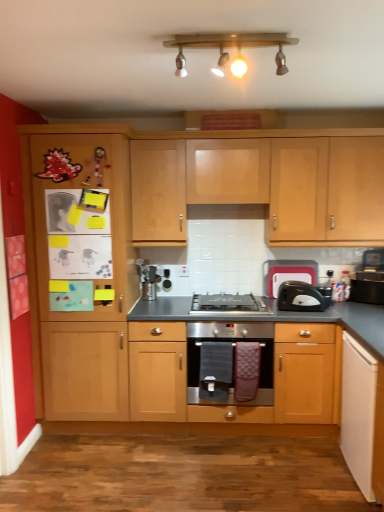
Question: Considering the relative positions of light wood cabinet at upper center, marked as the third cabinetry in a bottom-to-top arrangement, and satin black gas stove at center in the image provided, is light wood cabinet at upper center, marked as the third cabinetry in a bottom-to-top arrangement, to the right of satin black gas stove at center from the viewer's perspective?

Choices:
 (A) yes
 (B) no

Answer: (A)

Question: Considering the relative sizes of light wood cabinet at upper center, acting as the first cabinetry starting from the top, and satin black gas stove at center in the image provided, is light wood cabinet at upper center, acting as the first cabinetry starting from the top, shorter than satin black gas stove at center?

Choices:
 (A) yes
 (B) no

Answer: (B)

Question: From a real-world perspective, is light wood cabinet at upper center, acting as the first cabinetry starting from the top, on satin black gas stove at center?

Choices:
 (A) no
 (B) yes

Answer: (B)

Question: Is light wood cabinet at upper center, marked as the third cabinetry in a bottom-to-top arrangement, aimed at satin black gas stove at center?

Choices:
 (A) no
 (B) yes

Answer: (A)

Question: Does light wood cabinet at upper center, acting as the first cabinetry starting from the top, have a greater width compared to satin black gas stove at center?

Choices:
 (A) no
 (B) yes

Answer: (A)

Question: Is light wood cabinet at upper center, marked as the third cabinetry in a bottom-to-top arrangement, bigger than wooden cabinet at left?

Choices:
 (A) yes
 (B) no

Answer: (B)

Question: Is the position of light wood cabinet at upper center, marked as the third cabinetry in a bottom-to-top arrangement, more distant than that of wooden cabinet at left?

Choices:
 (A) no
 (B) yes

Answer: (B)

Question: Is light wood cabinet at upper center, acting as the first cabinetry starting from the top, looking in the opposite direction of wooden cabinet at left?

Choices:
 (A) yes
 (B) no

Answer: (B)

Question: Are light wood cabinet at upper center, marked as the third cabinetry in a bottom-to-top arrangement, and wooden cabinet at left located far from each other?

Choices:
 (A) yes
 (B) no

Answer: (B)

Question: From the image's perspective, is light wood cabinet at upper center, acting as the first cabinetry starting from the top, on top of wooden cabinet at left?

Choices:
 (A) no
 (B) yes

Answer: (B)

Question: From a real-world perspective, is light wood cabinet at upper center, acting as the first cabinetry starting from the top, on wooden cabinet at left?

Choices:
 (A) yes
 (B) no

Answer: (A)

Question: Is satin silver oven at center surrounded by black plastic toaster at right, marked as the first appliance in a left-to-right arrangement?

Choices:
 (A) no
 (B) yes

Answer: (A)